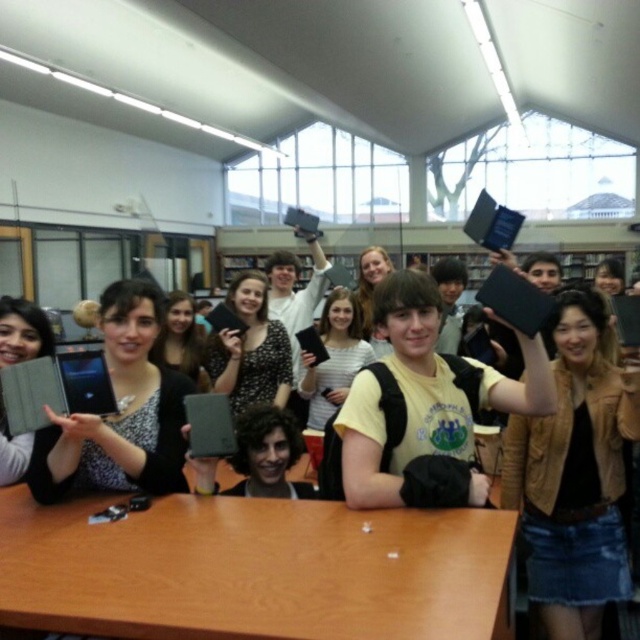
Question: In this image, where is brown leather jacket at upper right located relative to yellow matte t-shirt at center?

Choices:
 (A) below
 (B) above

Answer: (A)

Question: Which object is closer to the camera taking this photo?

Choices:
 (A) brown leather jacket at upper right
 (B) yellow matte t-shirt at center
 (C) matte black tablet at left

Answer: (C)

Question: Which object is the farthest from the brown leather jacket at upper right?

Choices:
 (A) black dotted shirt at center
 (B) wooden table at center
 (C) matte black tablet at left
 (D) yellow matte t-shirt at center

Answer: (A)

Question: Which object appears farthest from the camera in this image?

Choices:
 (A) black dotted shirt at center
 (B) yellow matte t-shirt at center
 (C) wooden table at center

Answer: (A)

Question: Can you confirm if matte black tablet at left is thinner than black dotted shirt at center?

Choices:
 (A) yes
 (B) no

Answer: (A)

Question: Is wooden table at center in front of brown leather jacket at upper right?

Choices:
 (A) no
 (B) yes

Answer: (B)